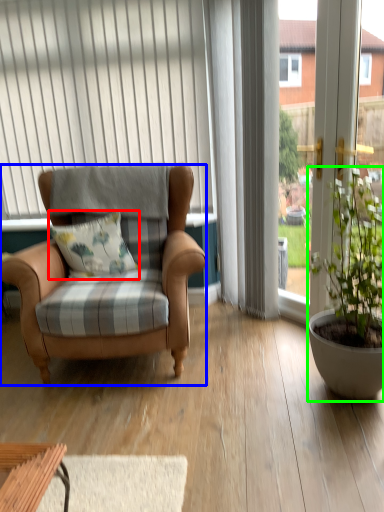
Question: Considering the real-world distances, which object is farthest from pillow (highlighted by a red box)? chair (highlighted by a blue box) or houseplant (highlighted by a green box)?

Choices:
 (A) chair
 (B) houseplant

Answer: (B)